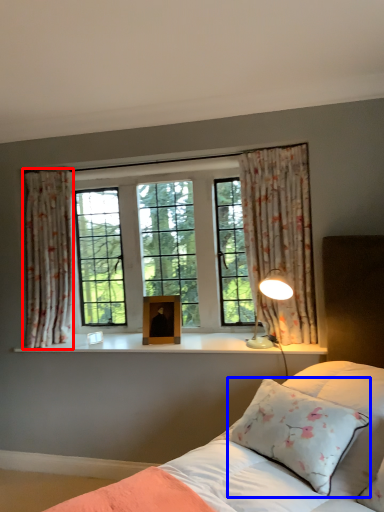
Question: Which object appears farthest to the camera in this image, curtain (highlighted by a red box) or pillow (highlighted by a blue box)?

Choices:
 (A) curtain
 (B) pillow

Answer: (A)